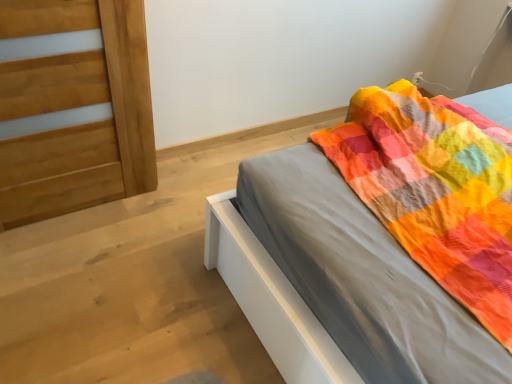
Question: From the image's perspective, is light brown wood door at left located above matte gray bed at center?

Choices:
 (A) yes
 (B) no

Answer: (A)

Question: Does light brown wood door at left have a greater height compared to matte gray bed at center?

Choices:
 (A) no
 (B) yes

Answer: (B)

Question: Are light brown wood door at left and matte gray bed at center located far from each other?

Choices:
 (A) no
 (B) yes

Answer: (A)

Question: Is light brown wood door at left at the right side of matte gray bed at center?

Choices:
 (A) yes
 (B) no

Answer: (B)

Question: Does light brown wood door at left have a greater width compared to matte gray bed at center?

Choices:
 (A) yes
 (B) no

Answer: (B)

Question: From a real-world perspective, is light brown wood door at left on top of matte gray bed at center?

Choices:
 (A) yes
 (B) no

Answer: (A)

Question: Is matte gray bed at center to the left of light brown wood door at left from the viewer's perspective?

Choices:
 (A) no
 (B) yes

Answer: (A)

Question: Does matte gray bed at center contain light brown wood door at left?

Choices:
 (A) no
 (B) yes

Answer: (A)

Question: Can you confirm if matte gray bed at center is bigger than light brown wood door at left?

Choices:
 (A) no
 (B) yes

Answer: (B)

Question: Could you tell me if matte gray bed at center is facing light brown wood door at left?

Choices:
 (A) yes
 (B) no

Answer: (B)

Question: From the image's perspective, does matte gray bed at center appear lower than light brown wood door at left?

Choices:
 (A) no
 (B) yes

Answer: (B)

Question: Can we say matte gray bed at center lies outside light brown wood door at left?

Choices:
 (A) no
 (B) yes

Answer: (B)

Question: Based on their positions, is matte gray bed at center located to the left or right of light brown wood door at left?

Choices:
 (A) right
 (B) left

Answer: (A)